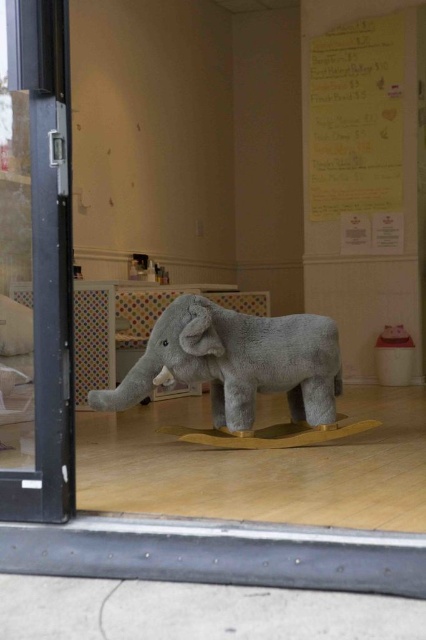
Question: Which point is farther to the camera?

Choices:
 (A) transparent glass door at left
 (B) gray plush elephant at center

Answer: (B)

Question: Which point appears closest to the camera in this image?

Choices:
 (A) (322, 54)
 (B) (40, 512)

Answer: (B)

Question: Does transparent glass door at left have a smaller size compared to yellow paper at upper center?

Choices:
 (A) yes
 (B) no

Answer: (A)

Question: Does yellow paper at upper center have a smaller size compared to gray plush elephant at center?

Choices:
 (A) yes
 (B) no

Answer: (B)

Question: Does yellow paper at upper center have a lesser width compared to gray plush elephant at center?

Choices:
 (A) no
 (B) yes

Answer: (B)

Question: Which point is closer to the camera?

Choices:
 (A) transparent glass door at left
 (B) gray plush elephant at center
 (C) yellow paper at upper center

Answer: (A)